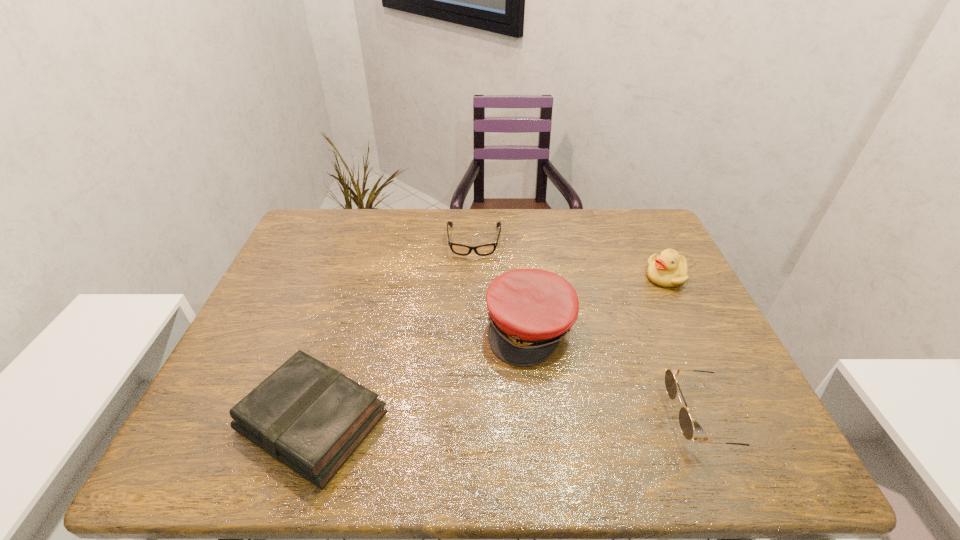
I want to click on unoccupied position between the fourth tallest object and the sunglasses, so click(x=509, y=420).

Where is `free space between the fourth nearest object and the book`? free space between the fourth nearest object and the book is located at coordinates (490, 349).

Find the location of a particular element. The height and width of the screenshot is (540, 960). vacant space that is in between the tallest object and the fourth nearest object is located at coordinates (598, 302).

Where is `empty space between the sunglasses and the duckling`? The height and width of the screenshot is (540, 960). empty space between the sunglasses and the duckling is located at coordinates (685, 347).

Where is `object that is the closest to the sunglasses`? This screenshot has height=540, width=960. object that is the closest to the sunglasses is located at coordinates (530, 310).

Find the location of a particular element. The image size is (960, 540). object that is the closest to the second farthest object is located at coordinates point(530,310).

Locate an element on the screen. This screenshot has height=540, width=960. vacant point that satisfies the following two spatial constraints: 1. on the back side of the cap; 2. on the right side of the duckling is located at coordinates (524, 276).

This screenshot has height=540, width=960. I want to click on vacant space that satisfies the following two spatial constraints: 1. on the back side of the duckling; 2. on the right side of the cap, so click(x=524, y=276).

The height and width of the screenshot is (540, 960). I want to click on vacant space that satisfies the following two spatial constraints: 1. on the front side of the sunglasses; 2. on the front lenses of the tallest object, so click(x=540, y=418).

Locate an element on the screen. vacant space that satisfies the following two spatial constraints: 1. on the back side of the cap; 2. on the left side of the fourth tallest object is located at coordinates (342, 328).